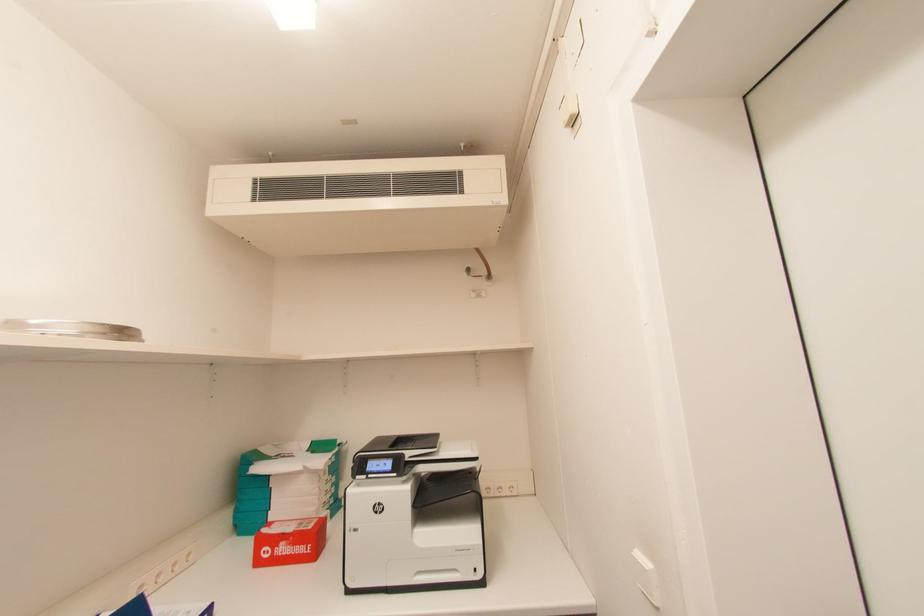
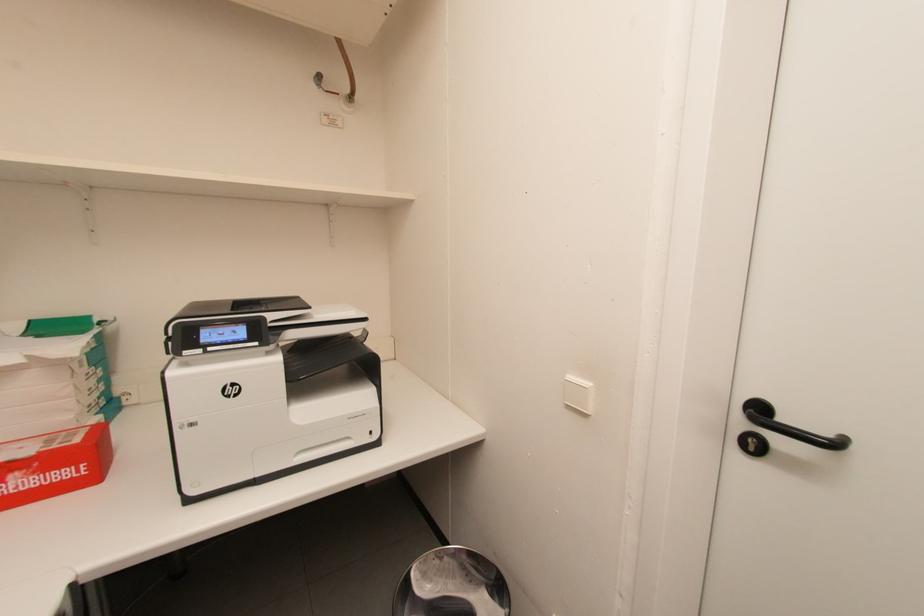
First-person continuous shooting, in which direction is the camera rotating?

The rotation direction of the camera is right-down.